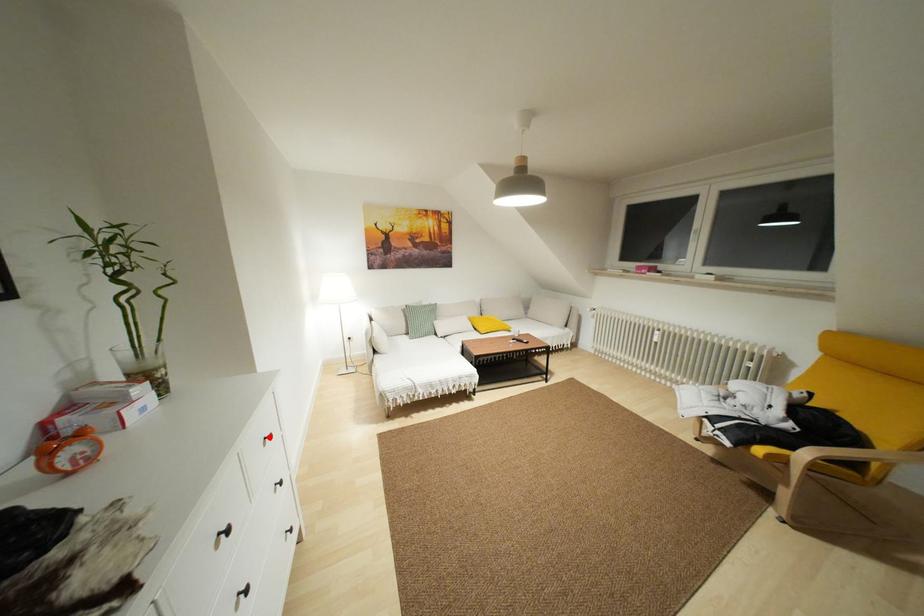
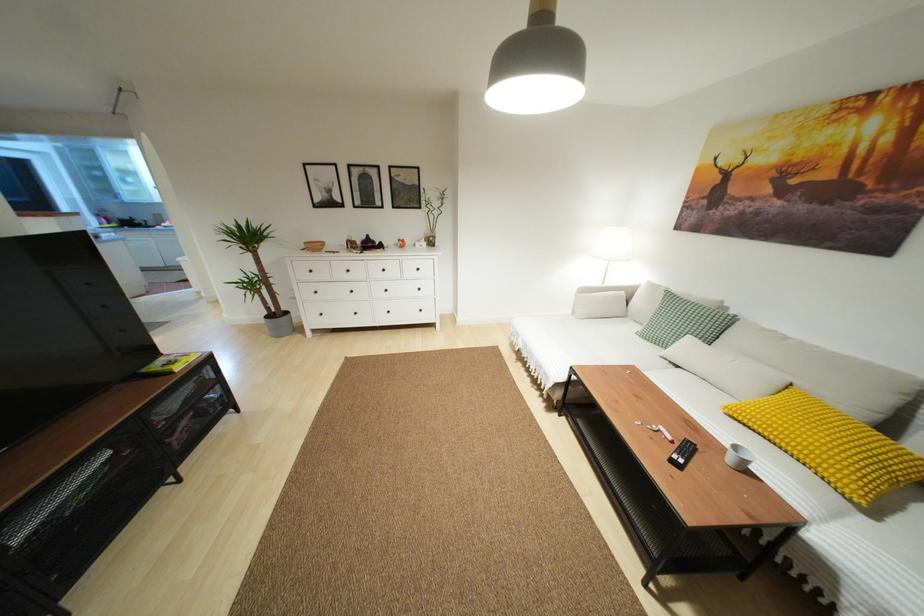
In the second image, find the point that corresponds to the highlighted location in the first image.

(418, 268)